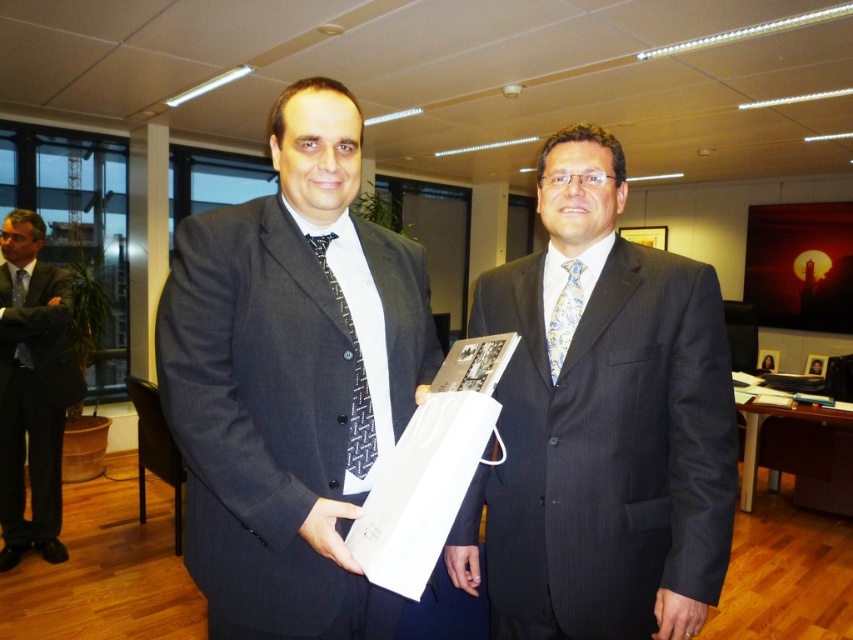
Consider the image. Is black suit at left further to camera compared to matte black tie at left?

No, it is in front of matte black tie at left.

Where is `black suit at left`? The width and height of the screenshot is (853, 640). black suit at left is located at coordinates (32, 388).

Is dark gray suit at center above black suit at left?

Yes.

Which is behind, point (212, 470) or point (33, 320)?

The point (33, 320) is more distant.

Where is `dark gray suit at center`? The height and width of the screenshot is (640, 853). dark gray suit at center is located at coordinates (291, 380).

Is point (258, 300) farther from viewer compared to point (28, 356)?

That is False.

Locate an element on the screen. dark gray suit at center is located at coordinates (291, 380).